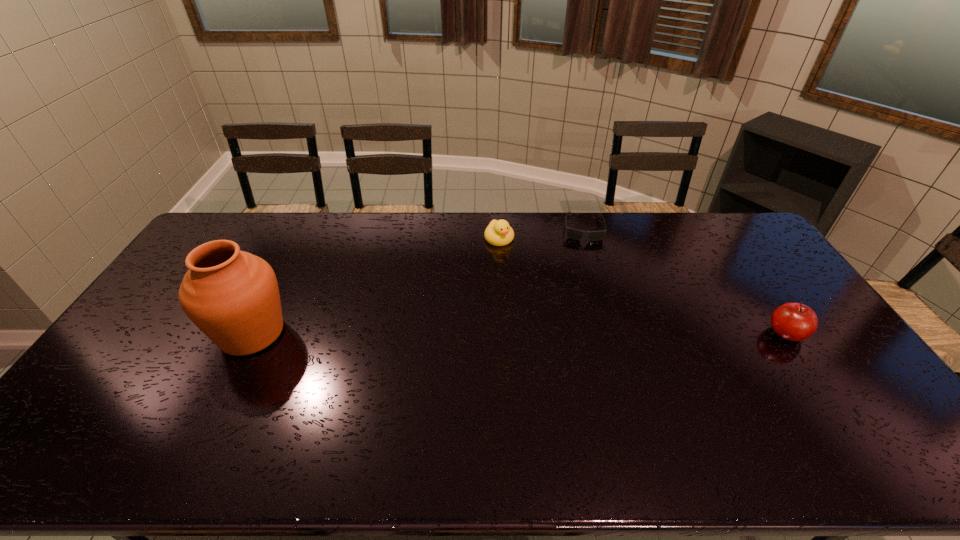
Where is `free space between the sunglasses and the duckling`? Image resolution: width=960 pixels, height=540 pixels. free space between the sunglasses and the duckling is located at coordinates (540, 233).

Where is `vacant space that is in between the second tallest object and the leftmost object`? This screenshot has height=540, width=960. vacant space that is in between the second tallest object and the leftmost object is located at coordinates (519, 333).

Image resolution: width=960 pixels, height=540 pixels. Find the location of `free spot between the leftmost object and the shortest object`. free spot between the leftmost object and the shortest object is located at coordinates (418, 280).

Identify the location of the second closest object relative to the duckling. point(232,296).

Locate an element on the screen. object that can be found as the second closest to the urn is located at coordinates (572, 233).

Where is `vacant region that satisfies the following two spatial constraints: 1. on the back side of the urn; 2. on the right side of the shortest object`? This screenshot has width=960, height=540. vacant region that satisfies the following two spatial constraints: 1. on the back side of the urn; 2. on the right side of the shortest object is located at coordinates click(x=305, y=228).

Where is `vacant area that satisfies the following two spatial constraints: 1. on the front side of the apple; 2. on the left side of the second shortest object`? vacant area that satisfies the following two spatial constraints: 1. on the front side of the apple; 2. on the left side of the second shortest object is located at coordinates (504, 334).